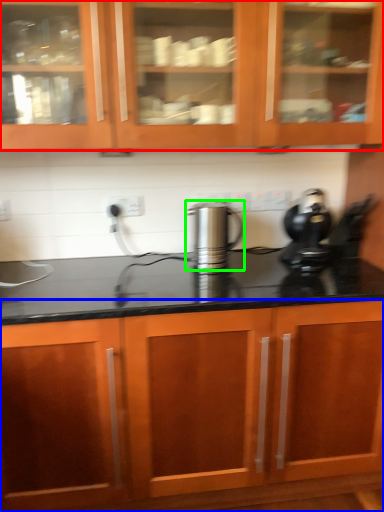
Question: Which object is positioned closest to cabinetry (highlighted by a red box)? Select from cabinetry (highlighted by a blue box) and kitchen appliance (highlighted by a green box).

Choices:
 (A) cabinetry
 (B) kitchen appliance

Answer: (B)